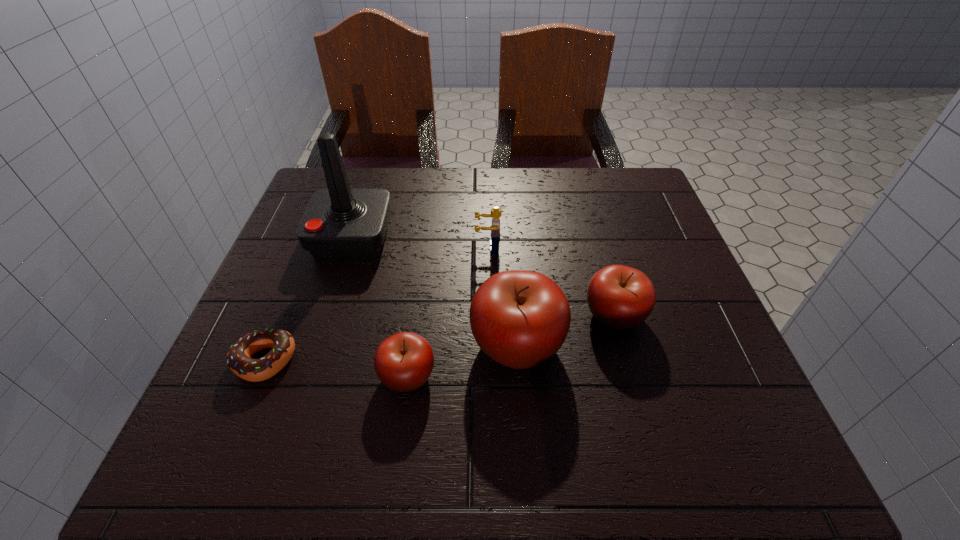
The height and width of the screenshot is (540, 960). I want to click on the fifth tallest object, so click(x=403, y=362).

Where is `the fourth object from right to left`? the fourth object from right to left is located at coordinates (403, 362).

Identify the location of the tallest apple. (520, 319).

Where is `the second tallest object`? the second tallest object is located at coordinates (520, 319).

This screenshot has height=540, width=960. I want to click on the rightmost object, so click(x=620, y=297).

Identify the location of the second tallest apple. click(620, 297).

At what (x,y) coordinates should I click in order to perform the action: click on Lego. Please return your answer as a coordinate pair (x, y). The width and height of the screenshot is (960, 540). Looking at the image, I should click on (496, 212).

Locate an element on the screen. doughnut is located at coordinates (239, 360).

Where is `joystick`? This screenshot has width=960, height=540. joystick is located at coordinates click(339, 222).

Where is `free space located 0.170m on the back of the fourth object from right to left`? The height and width of the screenshot is (540, 960). free space located 0.170m on the back of the fourth object from right to left is located at coordinates (420, 286).